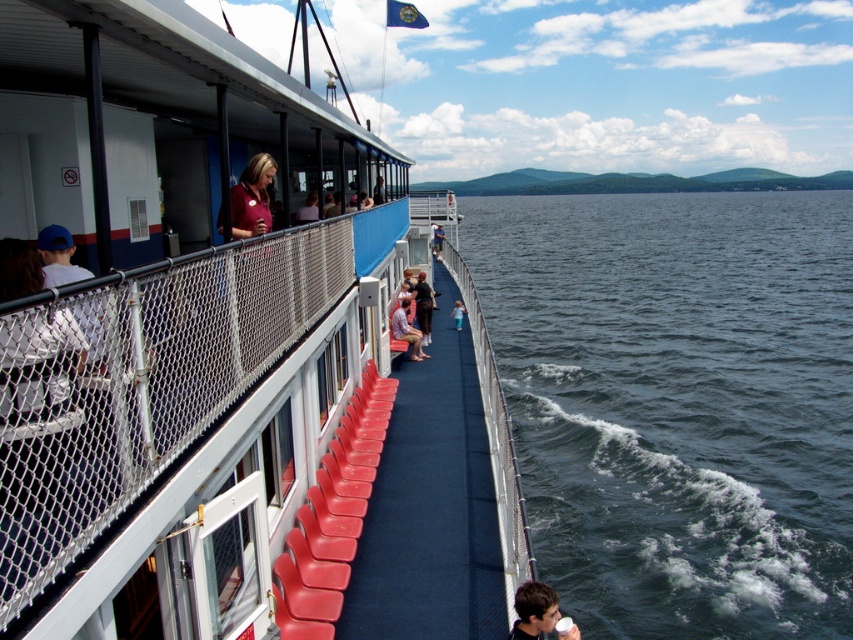
Question: Which point is farther from the camera taking this photo?

Choices:
 (A) (271, 552)
 (B) (419, 339)
 (C) (643, 612)

Answer: (B)

Question: Which object is closer to the camera taking this photo?

Choices:
 (A) dark blue water at lower right
 (B) matte pink shirt at center
 (C) matte black shirt at lower right
 (D) matte red seats at center

Answer: (D)

Question: Is matte red seats at center closer to the viewer compared to dark blue water at lower right?

Choices:
 (A) yes
 (B) no

Answer: (A)

Question: Is dark blue water at lower right thinner than matte black shirt at lower right?

Choices:
 (A) no
 (B) yes

Answer: (A)

Question: Does matte red seats at center appear under matte pink shirt at center?

Choices:
 (A) yes
 (B) no

Answer: (B)

Question: Which object is positioned farthest from the matte red seats at center?

Choices:
 (A) matte black shirt at lower right
 (B) matte pink shirt at center
 (C) dark blue water at lower right

Answer: (A)